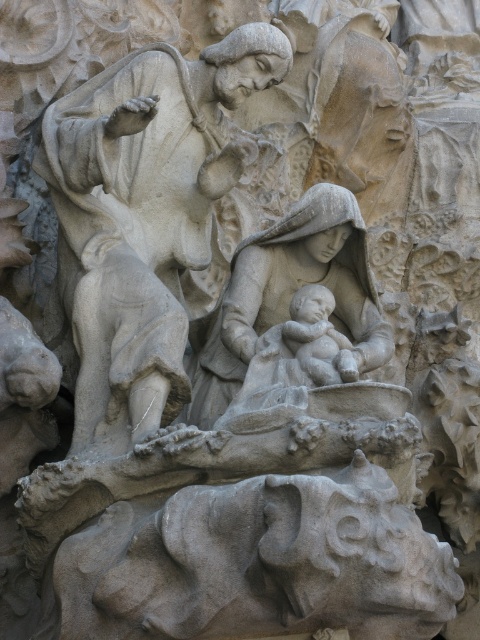
Is stone statue at upper center positioned before matte stone baby at center?

Yes, it is in front of matte stone baby at center.

The height and width of the screenshot is (640, 480). I want to click on stone statue at upper center, so click(x=144, y=212).

Can you confirm if stone statue at upper center is positioned to the left of gray stone statue of mother holding baby at center?

Correct, you'll find stone statue at upper center to the left of gray stone statue of mother holding baby at center.

This screenshot has height=640, width=480. I want to click on stone statue at upper center, so (144, 212).

Identify the location of stone statue at upper center. The image size is (480, 640). (144, 212).

Is gray stone statue of mother holding baby at center further to camera compared to matte stone baby at center?

No, it is not.

Can you confirm if gray stone statue of mother holding baby at center is positioned to the left of matte stone baby at center?

Incorrect, gray stone statue of mother holding baby at center is not on the left side of matte stone baby at center.

Does point (245, 368) lie in front of point (145, 264)?

That is True.

Locate an element on the screen. The image size is (480, 640). gray stone statue of mother holding baby at center is located at coordinates (290, 294).